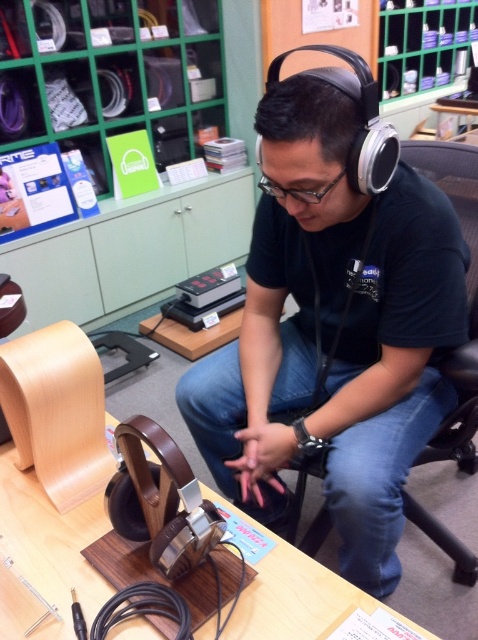
Question: Does matte black headphones at center appear on the left side of brown wood table at center?

Choices:
 (A) no
 (B) yes

Answer: (A)

Question: Which point is farther to the camera?

Choices:
 (A) click(282, 620)
 (B) click(280, 99)

Answer: (B)

Question: Which point is closer to the camera taking this photo?

Choices:
 (A) (221, 392)
 (B) (42, 531)

Answer: (B)

Question: Is matte black headphones at center above brown wood table at center?

Choices:
 (A) no
 (B) yes

Answer: (B)

Question: Is matte black headphones at center further to camera compared to brown wood table at center?

Choices:
 (A) no
 (B) yes

Answer: (B)